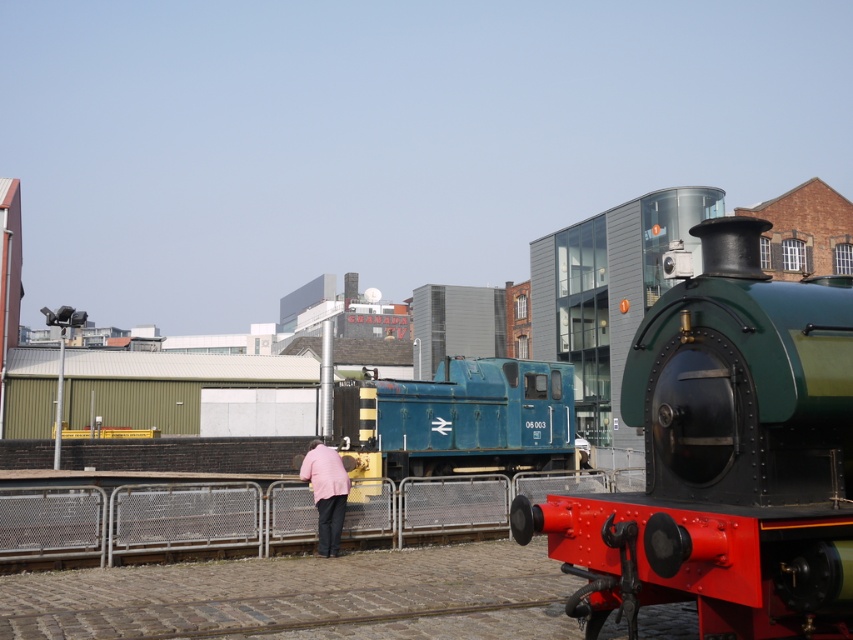
You are standing at point (688, 333) and want to walk to point (347, 384). Are you facing the same direction as the vintage steam locomotive with a green body and red front on the right side of the frame?

Yes, since point (688, 333) is in front of point (347, 384), you are facing the same direction as the vintage steam locomotive with a green body and red front on the right side of the frame, which has its front facing the viewer.

You are a photographer standing at the back of the green polished metal train at center. You want to take a photo of the metallic fence at center without the train blocking the view. Is the fence visible from your current position?

The green polished metal train at center is taller than metallic fence at center, so the fence might be partially or fully obscured by the train from your current position. Move to a higher vantage point or reposition yourself to ensure the fence is visible.